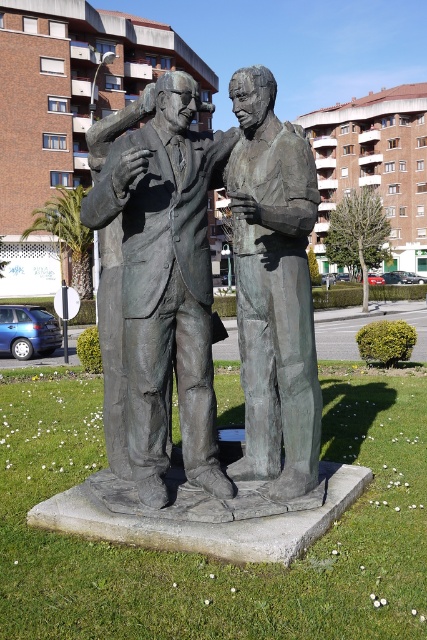
You are a city planner who wants to install a new bench in the public square. The bench will be placed between the bronze statue at center and the bronze statue of man at center. What is the minimum length of the bench required to fit between them?

The bronze statue at center and bronze statue of man at center are 19.07 inches apart from each other. Therefore, the minimum length of the bench required to fit between them should be at least 19.07 inches to ensure it spans the space between both statues.

You are standing in front of the bronze statue in the public square. You notice two points marked on the statue. One is at point coordinates point [149,193] and the other is at point coordinates point [274,145]. Which point is closer to you?

The point at coordinates point [149,193] is closer to you than the point at coordinates point [274,145].

You are standing in the public square and see the bronze statue at center and the bronze statue of man at center. Which one is positioned more to the left?

The bronze statue at center is positioned to the left of the bronze statue of man at center, so it is more to the left.